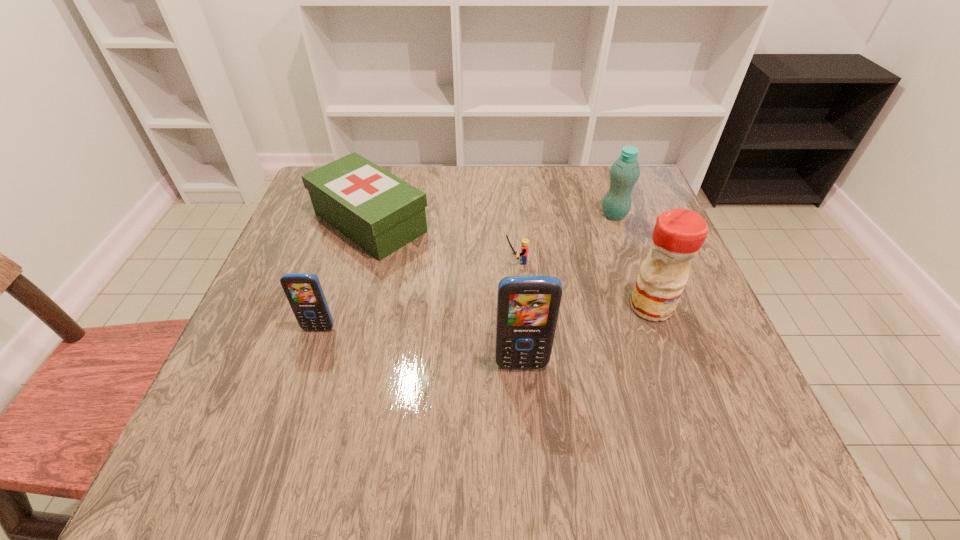
Find the location of a particular element. This screenshot has height=540, width=960. the third shortest object is located at coordinates (304, 292).

At what (x,y) coordinates should I click in order to perform the action: click on the second nearest object. Please return your answer as a coordinate pair (x, y). This screenshot has width=960, height=540. Looking at the image, I should click on (304, 292).

Identify the location of the right cellular telephone. (528, 307).

Identify the location of the nearer cellular telephone. (528, 307).

You are a GUI agent. You are given a task and a screenshot of the screen. Output one action in this format:
    pyautogui.click(x=<x>, y=<y>)
    Task: Click on the shortest object
    The image size is (960, 540).
    Given the screenshot: What is the action you would take?
    pyautogui.click(x=525, y=242)

At what (x,y) coordinates should I click in order to perform the action: click on the fifth tallest object. Please return your answer as a coordinate pair (x, y). The width and height of the screenshot is (960, 540). Looking at the image, I should click on (380, 212).

The image size is (960, 540). What are the coordinates of `water bottle` in the screenshot? It's located at (625, 171).

The image size is (960, 540). In order to click on the fourth farthest object in this screenshot , I will do `click(678, 235)`.

At what (x,y) coordinates should I click in order to perform the action: click on vacant space located on the screen of the left cellular telephone. Please return your answer as a coordinate pair (x, y). Looking at the image, I should click on (291, 415).

Identify the location of free space located 0.110m on the front-facing side of the shortest object. (455, 261).